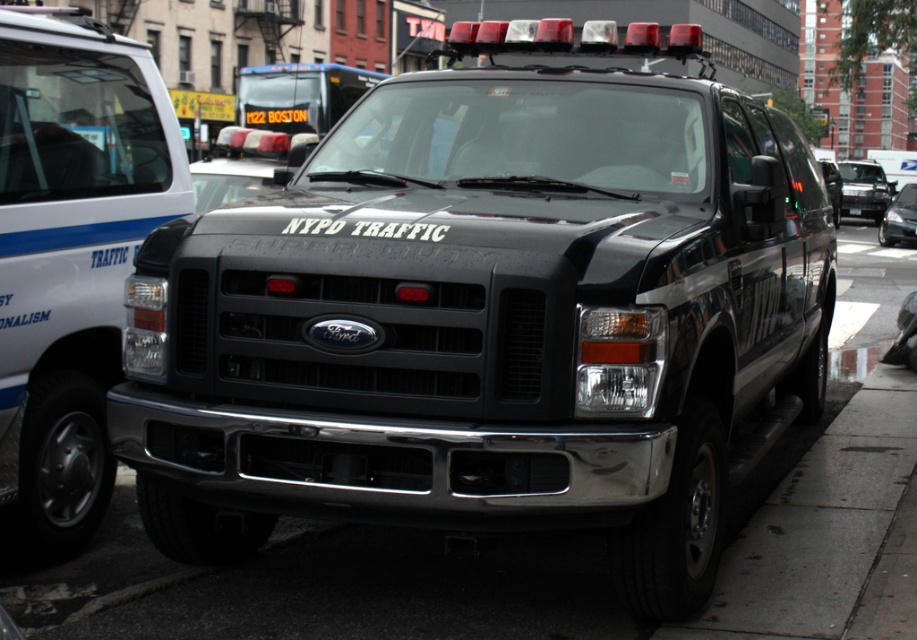
Looking at this image, you are a traffic officer standing at the scene. You need to mark a point at coordinates (864, 188) on the black glossy suv at center. Where exactly on the vehicle should you place this mark?

The point at coordinates (864, 188) is located on the black glossy suv at center, so you should place the mark on the black glossy suv at center.

You are a driver approaching the intersection where the black Ford SUV is parked. You notice two points marked on the road ahead. The first point is at coordinates point [50,182] and the second is at point [867,195]. Which point is closer to your current position?

Point [50,182] is closer to the camera than point [867,195], so the first point is closer to your current position.

You are a delivery person trying to park your van next to the black Ford SUV. There is a white glossy van at left and a black plastic license plate at center in the scene. Which object is taller and would require more vertical clearance when parking?

The white glossy van at left is much taller than the black plastic license plate at center, so it would require more vertical clearance when parking.